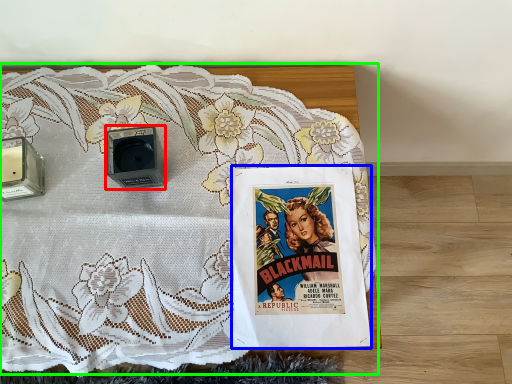
Question: Which object is positioned farthest from speaker (highlighted by a red box)? Select from comic book (highlighted by a blue box) and bed (highlighted by a green box).

Choices:
 (A) comic book
 (B) bed

Answer: (A)